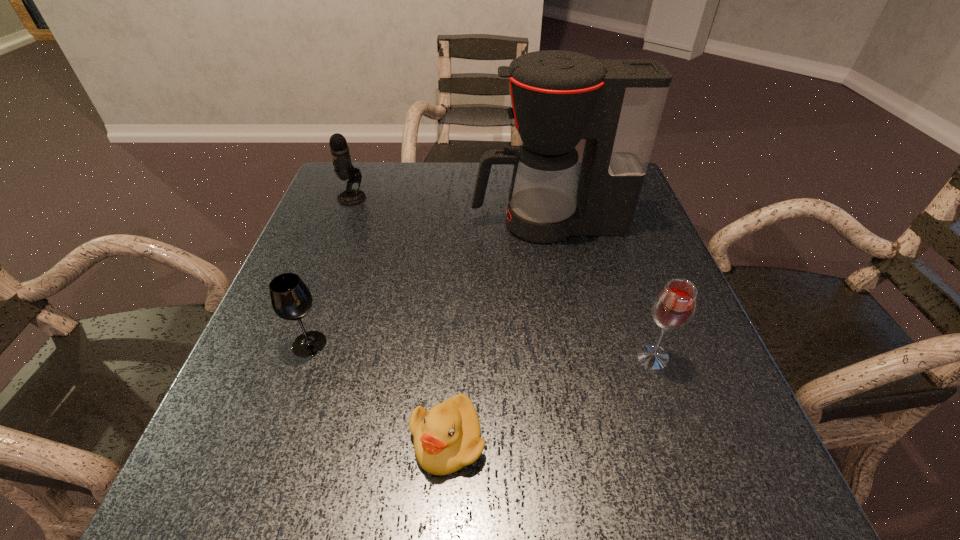
Find the location of `free point between the tallest object and the duckling`. free point between the tallest object and the duckling is located at coordinates (498, 332).

Where is `free space between the shortest object and the right wineglass`? This screenshot has height=540, width=960. free space between the shortest object and the right wineglass is located at coordinates (550, 399).

Image resolution: width=960 pixels, height=540 pixels. I want to click on empty space between the microphone and the shortest object, so click(399, 319).

Find the location of a particular element. This screenshot has height=540, width=960. vacant space that's between the shortest object and the tallest object is located at coordinates (498, 332).

The image size is (960, 540). Find the location of `vacant region between the right wineglass and the coffee maker`. vacant region between the right wineglass and the coffee maker is located at coordinates (601, 291).

Where is `free point between the left wineglass and the microphone`? This screenshot has height=540, width=960. free point between the left wineglass and the microphone is located at coordinates (330, 271).

In order to click on free space between the left wineglass and the duckling in this screenshot , I will do `click(378, 392)`.

Identify which object is the fourth closest to the tallest object. Please provide its 2D coordinates. Your answer should be formatted as a tuple, i.e. [(x, y)], where the tuple contains the x and y coordinates of a point satisfying the conditions above.

[(447, 438)]

Select which object is the third closest to the tallest object. Please provide its 2D coordinates. Your answer should be formatted as a tuple, i.e. [(x, y)], where the tuple contains the x and y coordinates of a point satisfying the conditions above.

[(290, 298)]

Image resolution: width=960 pixels, height=540 pixels. In order to click on vacant area that satisfies the following two spatial constraints: 1. on the front side of the right wineglass; 2. on the right side of the microphone in this screenshot , I will do `click(290, 357)`.